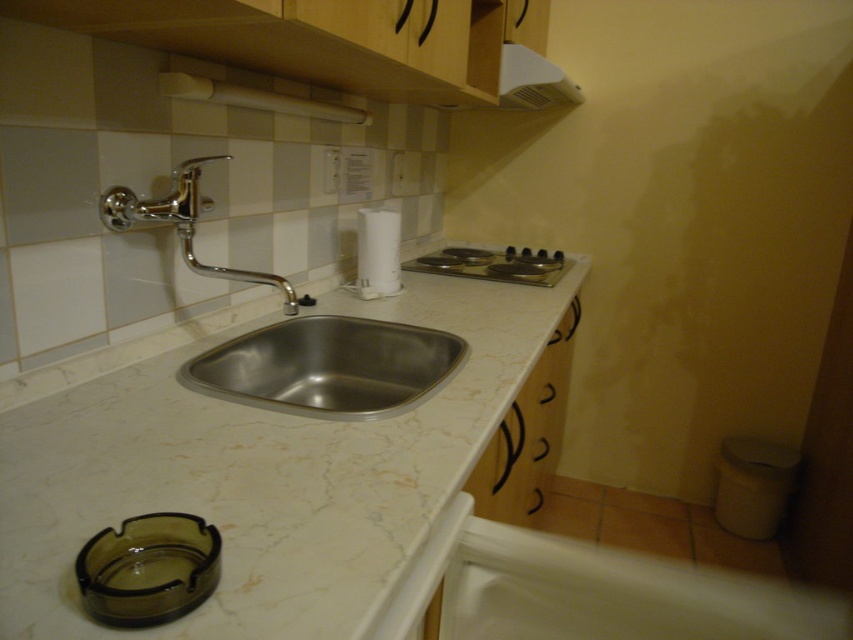
Question: Considering the real-world distances, which object is closest to the stainless steel sink at center?

Choices:
 (A) marble/stone counter top at center
 (B) chrome/metallic faucet at upper left

Answer: (A)

Question: Can you confirm if stainless steel sink at center is positioned above chrome/metallic faucet at upper left?

Choices:
 (A) no
 (B) yes

Answer: (A)

Question: Which point appears closest to the camera in this image?

Choices:
 (A) (262, 330)
 (B) (436, 317)

Answer: (A)

Question: Which object is closer to the camera taking this photo?

Choices:
 (A) marble/stone counter top at center
 (B) chrome/metallic faucet at upper left

Answer: (A)

Question: Does stainless steel sink at center appear on the left side of chrome/metallic faucet at upper left?

Choices:
 (A) no
 (B) yes

Answer: (A)

Question: Can you confirm if stainless steel sink at center is positioned above chrome/metallic faucet at upper left?

Choices:
 (A) yes
 (B) no

Answer: (B)